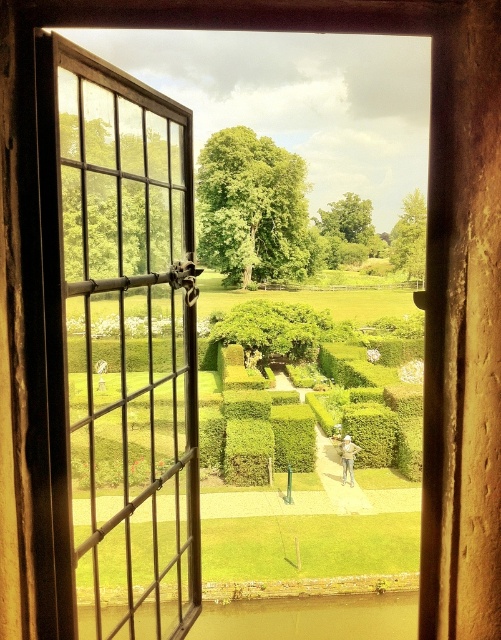
You are standing in a room and looking out through an open window. There is a black metal window at left at point (128, 348). Is there anything else at that specific coordinate?

Yes, at point (128, 348) lies the black metal window at left.

You are standing in a room and looking through the open window. You notice two points marked in the scene. The first point is at coordinates point (x=137, y=314), and the second point is at point (x=354, y=449). Which of these two points is closer to you?

Point (x=137, y=314) is further to the camera than point (x=354, y=449), so the point closer to you is point (x=354, y=449).